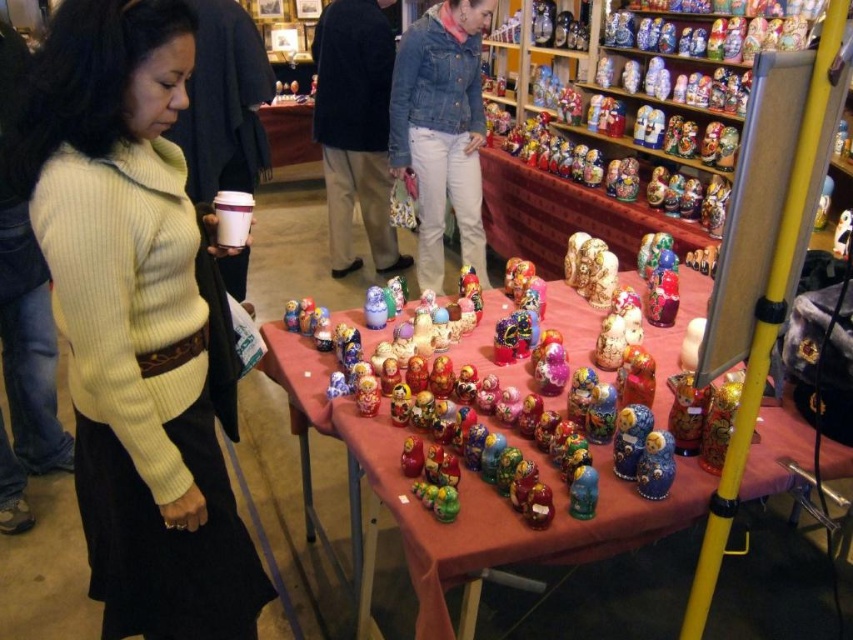
Is ribbed knit sweater at left in front of shiny blue doll at center?

That is True.

Is point (167, 337) farther from camera compared to point (643, 449)?

No.

Does point (152, 468) lie in front of point (656, 440)?

That is True.

Where is `ribbed knit sweater at left`? The width and height of the screenshot is (853, 640). ribbed knit sweater at left is located at coordinates (134, 321).

Between point (357, 129) and point (645, 483), which one is positioned in front?

Point (645, 483) is in front.

Is denim jacket at upper center to the right of shiny blue doll at center from the viewer's perspective?

In fact, denim jacket at upper center is to the left of shiny blue doll at center.

Find the location of `denim jacket at upper center`. denim jacket at upper center is located at coordinates click(355, 129).

Can you confirm if blue glossy matryoshka doll at center is wider than shiny metallic toy at center?

Incorrect, blue glossy matryoshka doll at center's width does not surpass shiny metallic toy at center's.

Is blue glossy matryoshka doll at center positioned behind shiny metallic toy at center?

Yes, it is behind shiny metallic toy at center.

Measure the distance between point (589, 513) and camera.

Point (589, 513) is 4.32 feet from camera.

This screenshot has width=853, height=640. Identify the location of blue glossy matryoshka doll at center. (583, 492).